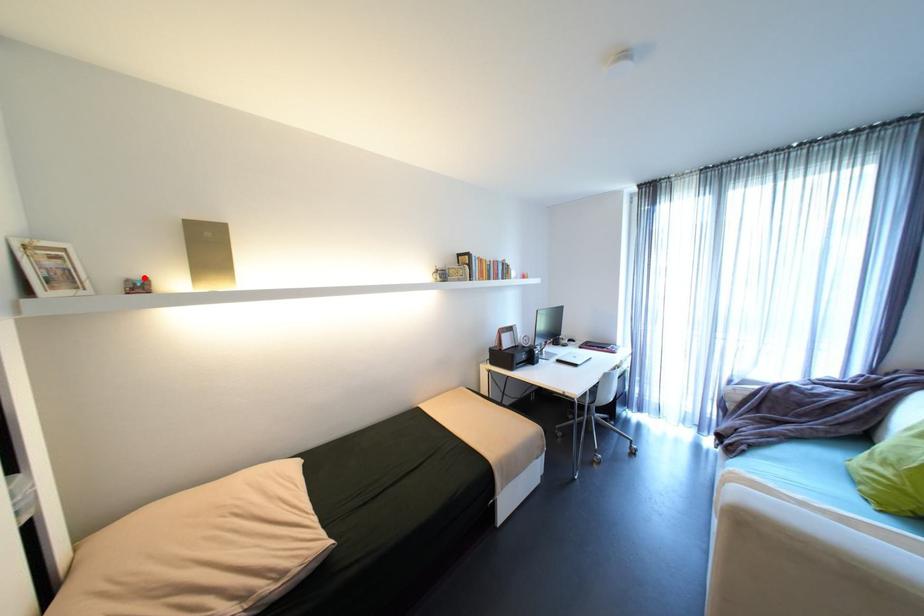
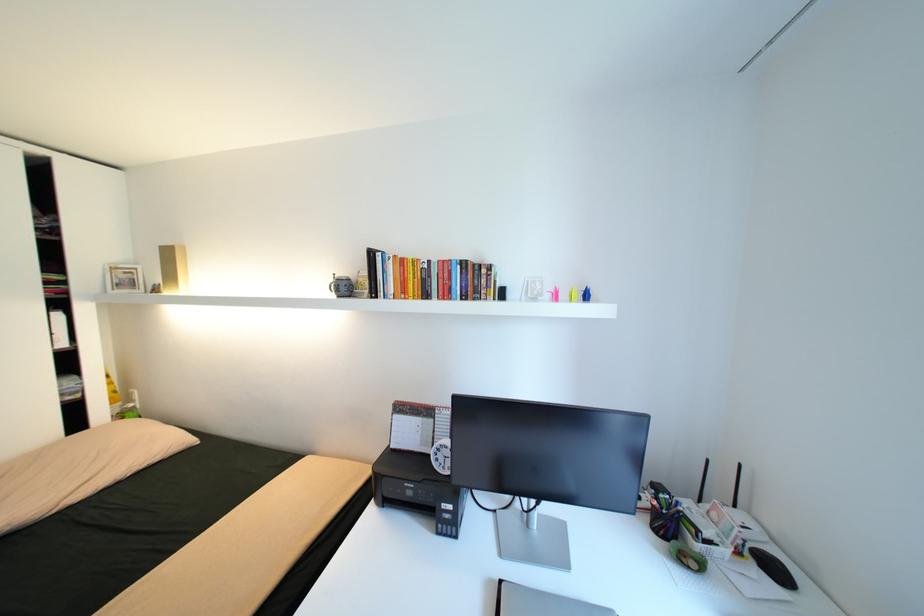
Find the pixel in the second image that matches the highlighted location in the first image.

(164, 284)